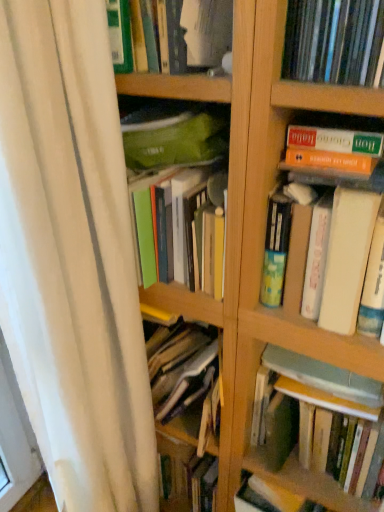
Question: Considering the positions of green matte book at upper center, marked as the 4th book in a bottom-to-top arrangement, and white fabric shower curtain at left in the image, is green matte book at upper center, marked as the 4th book in a bottom-to-top arrangement, taller or shorter than white fabric shower curtain at left?

Choices:
 (A) tall
 (B) short

Answer: (B)

Question: Looking at their shapes, would you say green matte book at upper center, arranged as the first book when viewed from the top, is wider or thinner than white fabric shower curtain at left?

Choices:
 (A) wide
 (B) thin

Answer: (A)

Question: Considering the real-world distances, which object is closest to the hardcover book at upper right, the second book when ordered from bottom to top?

Choices:
 (A) white fabric shower curtain at left
 (B) matte plastic books at upper right, the 3th book positioned from the bottom
 (C) hardcover book at center, acting as the 1th book starting from the bottom
 (D) green matte book at upper center, arranged as the first book when viewed from the top

Answer: (B)

Question: Which object is the closest to the white fabric shower curtain at left?

Choices:
 (A) hardcover book at upper right, the second book when ordered from bottom to top
 (B) matte plastic books at upper right, the 3th book positioned from the bottom
 (C) hardcover book at center, acting as the 1th book starting from the bottom
 (D) green matte book at upper center, arranged as the first book when viewed from the top

Answer: (C)